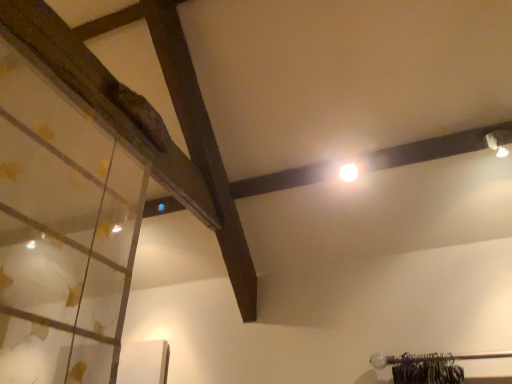
Locate an element on the screen. The height and width of the screenshot is (384, 512). transparent glass at upper left is located at coordinates (x=61, y=234).

Describe the element at coordinates (61, 234) in the screenshot. This screenshot has width=512, height=384. I see `transparent glass at upper left` at that location.

Where is `transparent glass at upper left`? This screenshot has width=512, height=384. transparent glass at upper left is located at coordinates (61, 234).